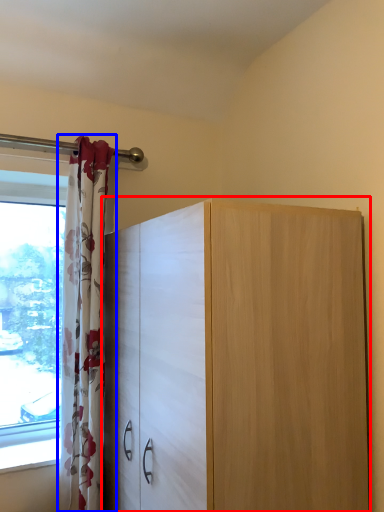
Question: Which object appears farthest to the camera in this image, cupboard (highlighted by a red box) or curtain (highlighted by a blue box)?

Choices:
 (A) cupboard
 (B) curtain

Answer: (B)